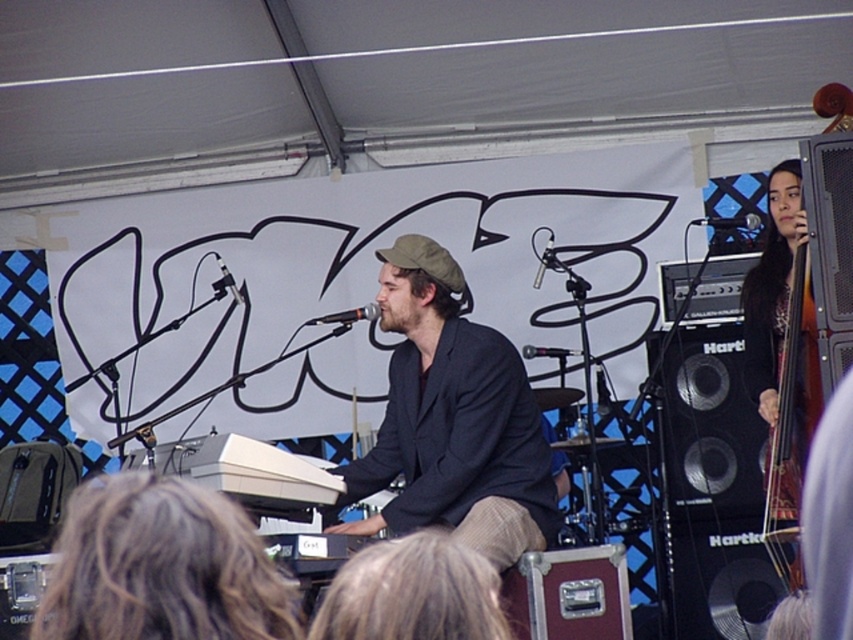
Does black matte microphone at upper center have a lesser height compared to black matte microphone at center?

Incorrect, black matte microphone at upper center's height does not fall short of black matte microphone at center's.

Can you confirm if black matte microphone at upper center is positioned to the right of black matte microphone at center?

Incorrect, black matte microphone at upper center is not on the right side of black matte microphone at center.

Who is more forward, (212, 285) or (550, 349)?

Point (550, 349)

Locate an element on the screen. The height and width of the screenshot is (640, 853). black matte microphone at upper center is located at coordinates (225, 282).

Is blonde hair at lower center wider than black metallic microphone at upper center?

No.

Who is taller, blonde hair at lower center or black metallic microphone at upper center?

Standing taller between the two is blonde hair at lower center.

Measure the distance between blonde hair at lower center and camera.

They are 1.97 meters apart.

Identify the location of blonde hair at lower center. (412, 593).

Does dark gray fabric jacket at center appear on the right side of black metallic microphone at center?

Yes, dark gray fabric jacket at center is to the right of black metallic microphone at center.

Is dark gray fabric jacket at center smaller than black metallic microphone at center?

Actually, dark gray fabric jacket at center might be larger than black metallic microphone at center.

Who is more forward, (543, 488) or (326, 323)?

Point (543, 488) is more forward.

Where is `dark gray fabric jacket at center`? dark gray fabric jacket at center is located at coordinates (451, 420).